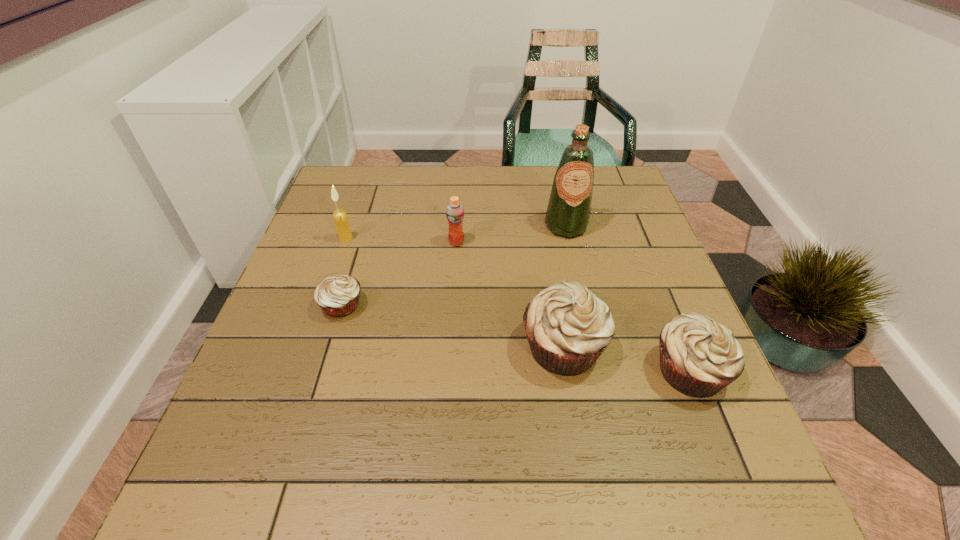
Identify the location of vacant region that satisfies the following two spatial constraints: 1. on the front side of the fifth tallest object; 2. on the right side of the fifth shortest object. (300, 370).

You are a GUI agent. You are given a task and a screenshot of the screen. Output one action in this format:
    pyautogui.click(x=<x>, y=<y>)
    Task: Click on the vacant area in the image that satisfies the following two spatial constraints: 1. on the front-facing side of the tallest object; 2. on the right side of the rightmost muffin
    
    Given the screenshot: What is the action you would take?
    pyautogui.click(x=599, y=370)